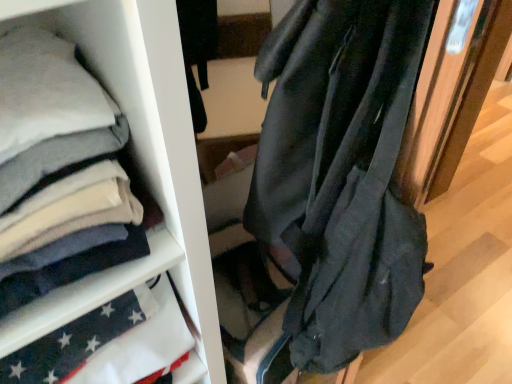
Describe the element at coordinates (152, 134) in the screenshot. I see `white soft fabric at upper left` at that location.

At what (x,y) coordinates should I click in order to perform the action: click on white soft fabric at upper left. Please return your answer as a coordinate pair (x, y). The image size is (512, 384). Looking at the image, I should click on (152, 134).

Measure the distance between point (73, 309) and camera.

A distance of 20.08 inches exists between point (73, 309) and camera.

In order to click on white soft fabric at upper left in this screenshot , I will do `click(152, 134)`.